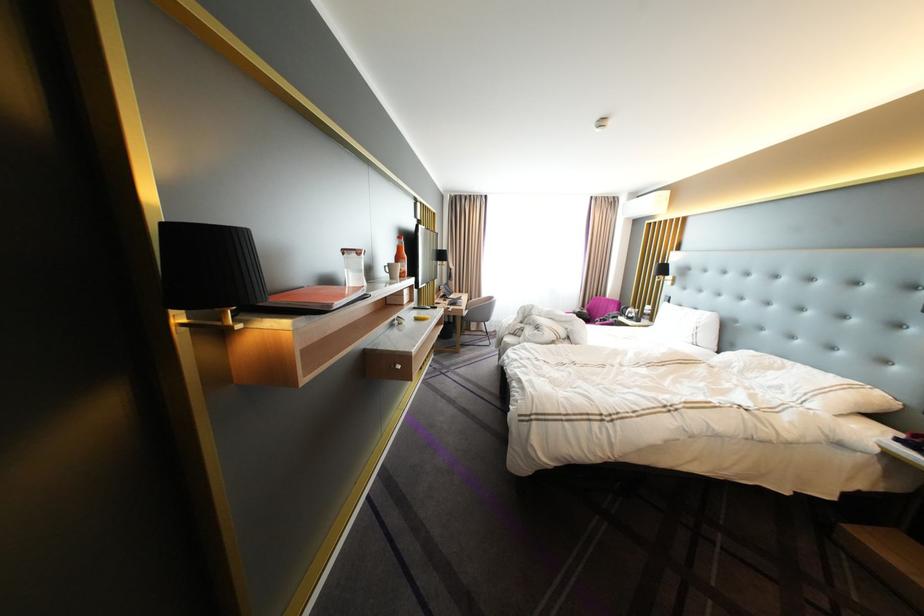
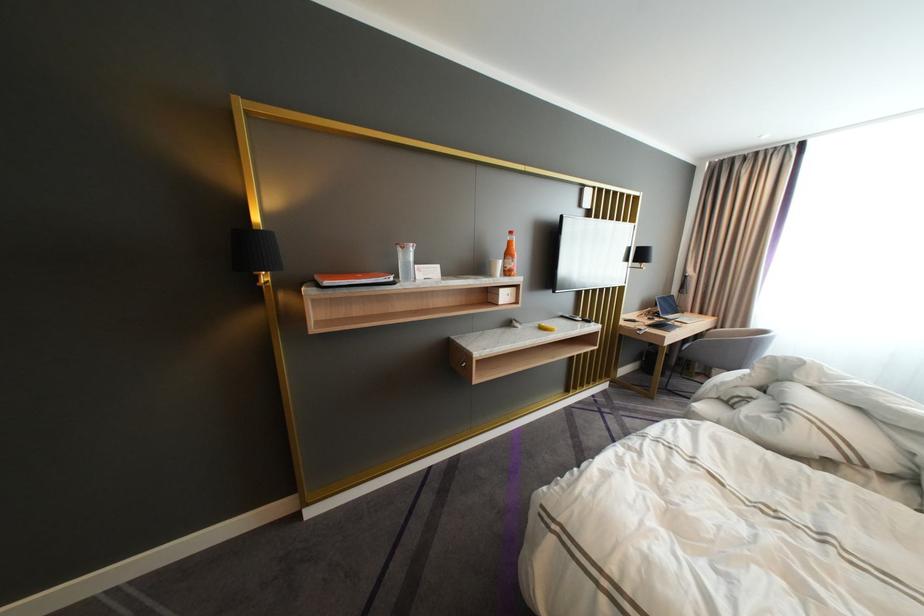
In the second image, find the point that corresponds to [464,297] in the first image.

(683, 317)